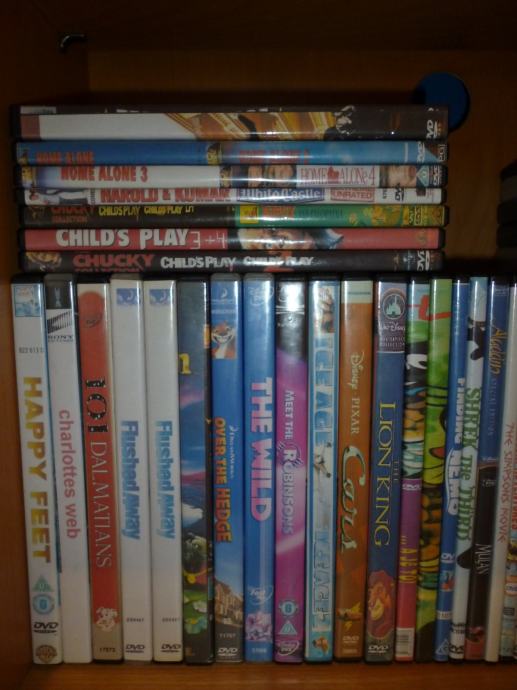
Where is `dvds stacked on top of others`? dvds stacked on top of others is located at coordinates [185, 108], [184, 126], [189, 148], [190, 172], [187, 192], [188, 208], [186, 235], [186, 257].